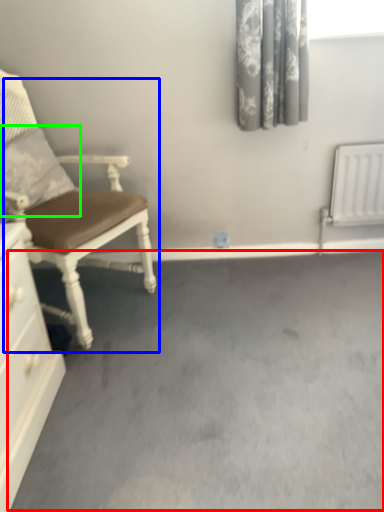
Question: Which object is the closest to the concrete (highlighted by a red box)? Choose among these: chair (highlighted by a blue box) or pillow (highlighted by a green box).

Choices:
 (A) chair
 (B) pillow

Answer: (A)